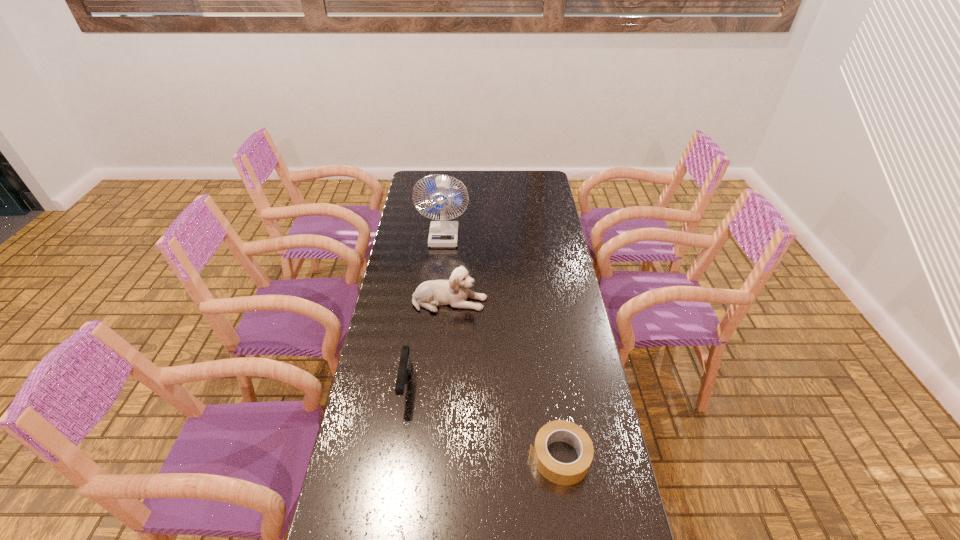
At what (x,y) coordinates should I click in order to perform the action: click on vacant space positioned on the front-facing side of the third tallest object. Please return your answer as a coordinate pair (x, y). Looking at the image, I should click on (395, 465).

Image resolution: width=960 pixels, height=540 pixels. What are the coordinates of `vacant region located 0.170m at the edge of the shortest object` in the screenshot? It's located at (468, 457).

Locate an element on the screen. The height and width of the screenshot is (540, 960). vacant position located at the edge of the shortest object is located at coordinates (474, 457).

Where is `vacant area located 0.260m at the edge of the shortest object`? The width and height of the screenshot is (960, 540). vacant area located 0.260m at the edge of the shortest object is located at coordinates (434, 457).

Image resolution: width=960 pixels, height=540 pixels. I want to click on fan at the left edge, so click(x=443, y=233).

Image resolution: width=960 pixels, height=540 pixels. Identify the location of puppy that is at the left edge. coord(454,292).

In order to click on pistol present at the left edge in this screenshot , I will do `click(405, 366)`.

Identify the location of object present at the right edge. The height and width of the screenshot is (540, 960). (556, 472).

You are a GUI agent. You are given a task and a screenshot of the screen. Output one action in this format:
    pyautogui.click(x=<x>, y=<y>)
    Task: Click on the free location at the far edge
    The height and width of the screenshot is (540, 960).
    Given the screenshot: What is the action you would take?
    pyautogui.click(x=459, y=184)

You are a GUI agent. You are given a task and a screenshot of the screen. Output one action in this format:
    pyautogui.click(x=<x>, y=<y>)
    Task: Click on the vacant space at the left edge of the desktop
    The width and height of the screenshot is (960, 540).
    Given the screenshot: What is the action you would take?
    pyautogui.click(x=388, y=412)